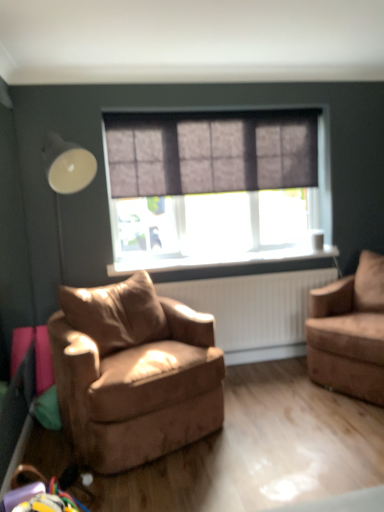
Question: Is brown leather chair at center, the 2th chair viewed from the right, outside white glossy table lamp at left?

Choices:
 (A) no
 (B) yes

Answer: (B)

Question: Can you confirm if brown leather chair at center, the 2th chair viewed from the right, is thinner than white glossy table lamp at left?

Choices:
 (A) yes
 (B) no

Answer: (B)

Question: Is brown leather chair at center, the 2th chair viewed from the right, shorter than white glossy table lamp at left?

Choices:
 (A) yes
 (B) no

Answer: (A)

Question: Is white glossy table lamp at left inside brown leather chair at center, which appears as the 1th chair when viewed from the left?

Choices:
 (A) no
 (B) yes

Answer: (A)

Question: Does brown leather chair at center, the 2th chair viewed from the right, come in front of white glossy table lamp at left?

Choices:
 (A) no
 (B) yes

Answer: (B)

Question: Is the depth of brown leather chair at center, the 2th chair viewed from the right, greater than that of white glossy table lamp at left?

Choices:
 (A) no
 (B) yes

Answer: (A)

Question: Is black plastic window sill at center to the left of suede brown armchair at right, which ranks as the first chair in right-to-left order, from the viewer's perspective?

Choices:
 (A) yes
 (B) no

Answer: (A)

Question: From a real-world perspective, is black plastic window sill at center physically below suede brown armchair at right, which ranks as the first chair in right-to-left order?

Choices:
 (A) yes
 (B) no

Answer: (B)

Question: Does black plastic window sill at center come in front of suede brown armchair at right, which ranks as the first chair in right-to-left order?

Choices:
 (A) no
 (B) yes

Answer: (A)

Question: Does black plastic window sill at center contain suede brown armchair at right, which ranks as the first chair in right-to-left order?

Choices:
 (A) no
 (B) yes

Answer: (A)

Question: Is black plastic window sill at center bigger than suede brown armchair at right, which ranks as the first chair in right-to-left order?

Choices:
 (A) yes
 (B) no

Answer: (B)

Question: Is black plastic window sill at center thinner than suede brown armchair at right, the second chair from the left?

Choices:
 (A) yes
 (B) no

Answer: (A)

Question: From the image's perspective, is black plastic window sill at center above dark grey textured curtain at center?

Choices:
 (A) yes
 (B) no

Answer: (B)